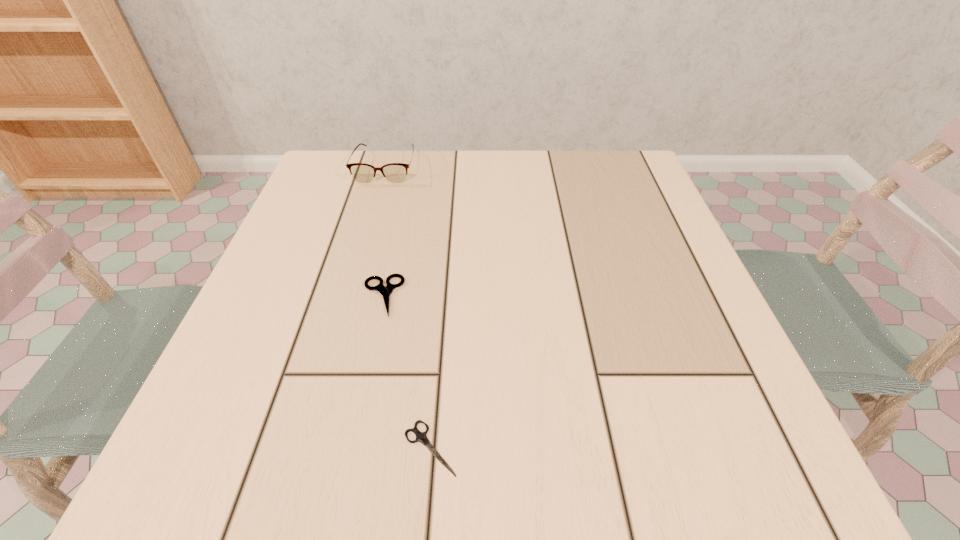
This screenshot has height=540, width=960. What are the coordinates of `the tallest object` in the screenshot? It's located at (394, 172).

This screenshot has width=960, height=540. Identify the location of spectacles. (394, 172).

The width and height of the screenshot is (960, 540). Find the location of `the taller shears`. the taller shears is located at coordinates (386, 291).

Find the location of a particular element. Image resolution: width=960 pixels, height=540 pixels. the second shortest object is located at coordinates (386, 291).

You are a GUI agent. You are given a task and a screenshot of the screen. Output one action in this format:
    pyautogui.click(x=<x>, y=<y>)
    Task: Click on the nearest object
    
    Given the screenshot: What is the action you would take?
    pyautogui.click(x=421, y=437)

I want to click on the nearer shears, so click(x=421, y=437).

The height and width of the screenshot is (540, 960). What are the coordinates of `vacant region located on the face of the spectacles` in the screenshot? It's located at (360, 256).

Find the location of a particular element. This screenshot has width=960, height=540. vacant region located 0.090m on the left of the left shears is located at coordinates (310, 296).

Where is `vacant region located 0.390m on the back of the shorter shears`? This screenshot has width=960, height=540. vacant region located 0.390m on the back of the shorter shears is located at coordinates (447, 237).

This screenshot has height=540, width=960. I want to click on object that is positioned at the far edge, so click(x=394, y=172).